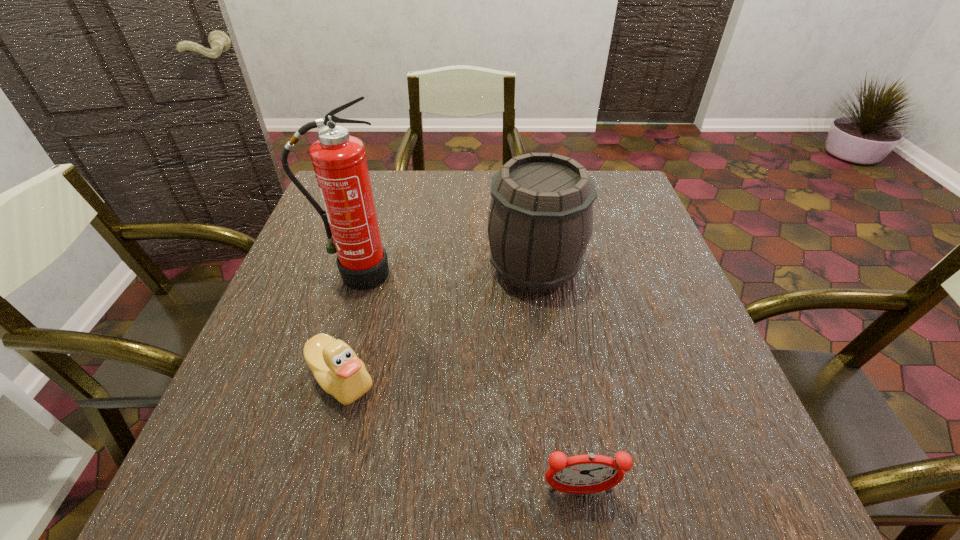
Locate an element on the screen. Image resolution: width=960 pixels, height=540 pixels. fire extinguisher is located at coordinates [x=339, y=161].

Identify the location of the third shortest object. (540, 221).

Find the location of a particular element. the third farthest object is located at coordinates (337, 369).

The height and width of the screenshot is (540, 960). In order to click on alarm clock in this screenshot , I will do click(582, 474).

Find the location of a particular element. This screenshot has width=960, height=540. free point located on the front-facing side of the fire extinguisher is located at coordinates (347, 307).

You are a GUI agent. You are given a task and a screenshot of the screen. Output one action in this format:
    pyautogui.click(x=<x>, y=<y>)
    Task: Click on the vacant area located 0.190m on the back of the wine bucket
    This screenshot has width=960, height=540.
    Given the screenshot: What is the action you would take?
    pyautogui.click(x=525, y=196)

The width and height of the screenshot is (960, 540). In order to click on blank area located 0.110m at the beak of the duck in this screenshot , I will do `click(316, 476)`.

This screenshot has width=960, height=540. I want to click on object present at the near edge, so click(x=582, y=474).

Find the location of `fire extinguisher at the left edge`. fire extinguisher at the left edge is located at coordinates (339, 161).

Find the location of a particular element. duck at the left edge is located at coordinates point(337,369).